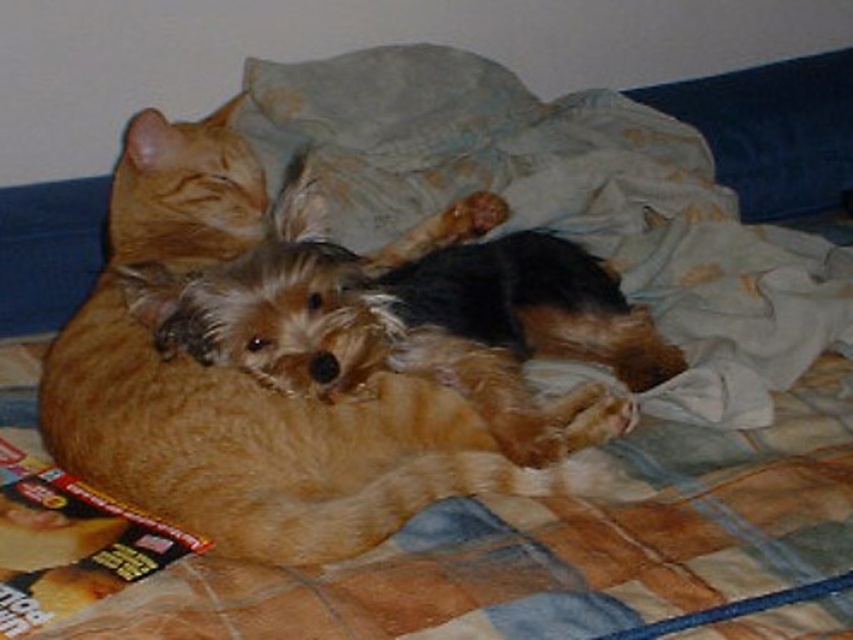
The height and width of the screenshot is (640, 853). Describe the element at coordinates (407, 317) in the screenshot. I see `fuzzy brown dog at center` at that location.

Is point (445, 344) less distant than point (705, 113)?

Yes, it is in front of point (705, 113).

Locate an element on the screen. This screenshot has width=853, height=640. fuzzy brown dog at center is located at coordinates (407, 317).

Is fuzzy brown dog at center closer to camera compared to matte plastic magazine at lower left?

No, it is not.

Who is more forward, (247,337) or (129,518)?

Point (129,518)

Where is `fuzzy brown dog at center`? The width and height of the screenshot is (853, 640). fuzzy brown dog at center is located at coordinates (407, 317).

Does blue fabric pillow at upper right appear under matte plastic magazine at lower left?

No.

Can you confirm if blue fabric pillow at upper right is positioned to the right of matte plastic magazine at lower left?

Correct, you'll find blue fabric pillow at upper right to the right of matte plastic magazine at lower left.

Does point (822, 196) lie in front of point (53, 483)?

No, it is not.

This screenshot has width=853, height=640. I want to click on blue fabric pillow at upper right, so click(x=772, y=131).